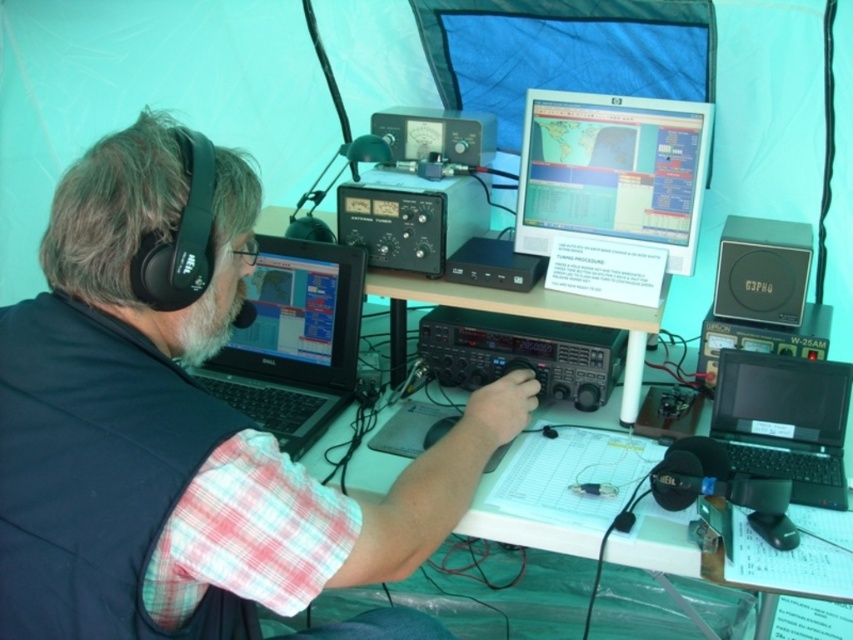
You are a technician trying to locate the black matte laptop at upper left in the radio station setup. What are its coordinates?

The coordinates of the black matte laptop at upper left are at point (178, 422).

You are setting up a temporary radio station inside a tent. You have a black matte laptop at upper left and a white plastic table at center. Where should you place the laptop to avoid it getting in the way of the table?

The black matte laptop at upper left is below the white plastic table at center, so placing it there would position it under the table, keeping it out of the way while still accessible.

You are setting up a temporary radio station inside a tent. You have a matte plastic monitor at center and a white plastic table at center. You want to place a new device that requires 10 inches of space between them. Can you fit it between the two objects?

The matte plastic monitor at center is only 9.09 inches away from the white plastic table at center, which is less than the required 10 inches. Therefore, you cannot fit the new device between them.